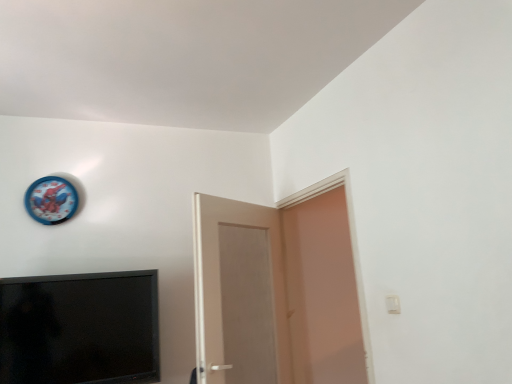
Question: Is matte white door at right, which ranks as the 2th door in left-to-right order, at the right side of blue plastic clock at upper left?

Choices:
 (A) yes
 (B) no

Answer: (A)

Question: Is the position of matte white door at right, which ranks as the 2th door in left-to-right order, more distant than that of blue plastic clock at upper left?

Choices:
 (A) no
 (B) yes

Answer: (A)

Question: From a real-world perspective, is matte white door at right, arranged as the first door when viewed from the right, below blue plastic clock at upper left?

Choices:
 (A) no
 (B) yes

Answer: (B)

Question: Is matte white door at right, arranged as the first door when viewed from the right, positioned beyond the bounds of blue plastic clock at upper left?

Choices:
 (A) yes
 (B) no

Answer: (A)

Question: Could blue plastic clock at upper left be considered to be inside matte white door at right, arranged as the first door when viewed from the right?

Choices:
 (A) yes
 (B) no

Answer: (B)

Question: Is there a large distance between matte white door at right, which ranks as the 2th door in left-to-right order, and blue plastic clock at upper left?

Choices:
 (A) no
 (B) yes

Answer: (B)

Question: Is matte white door at right, which ranks as the 2th door in left-to-right order, smaller than black matte television at lower left?

Choices:
 (A) yes
 (B) no

Answer: (B)

Question: From a real-world perspective, is matte white door at right, which ranks as the 2th door in left-to-right order, located beneath black matte television at lower left?

Choices:
 (A) yes
 (B) no

Answer: (B)

Question: Can you confirm if matte white door at right, which ranks as the 2th door in left-to-right order, is bigger than black matte television at lower left?

Choices:
 (A) no
 (B) yes

Answer: (B)

Question: Does matte white door at right, which ranks as the 2th door in left-to-right order, appear on the left side of black matte television at lower left?

Choices:
 (A) no
 (B) yes

Answer: (A)

Question: From the image's perspective, would you say matte white door at right, which ranks as the 2th door in left-to-right order, is shown under black matte television at lower left?

Choices:
 (A) no
 (B) yes

Answer: (A)

Question: Is black matte television at lower left a part of matte white door at right, arranged as the first door when viewed from the right?

Choices:
 (A) no
 (B) yes

Answer: (A)

Question: Is matte white door at right, which ranks as the 2th door in left-to-right order, to the right of white matte door at center, the 2th door viewed from the right, from the viewer's perspective?

Choices:
 (A) yes
 (B) no

Answer: (A)